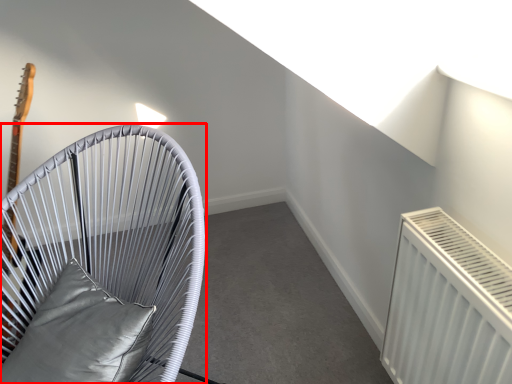
Question: Considering the relative positions of furniture (annotated by the red box) and pillow in the image provided, where is furniture (annotated by the red box) located with respect to the staircase?

Choices:
 (A) left
 (B) right

Answer: (A)